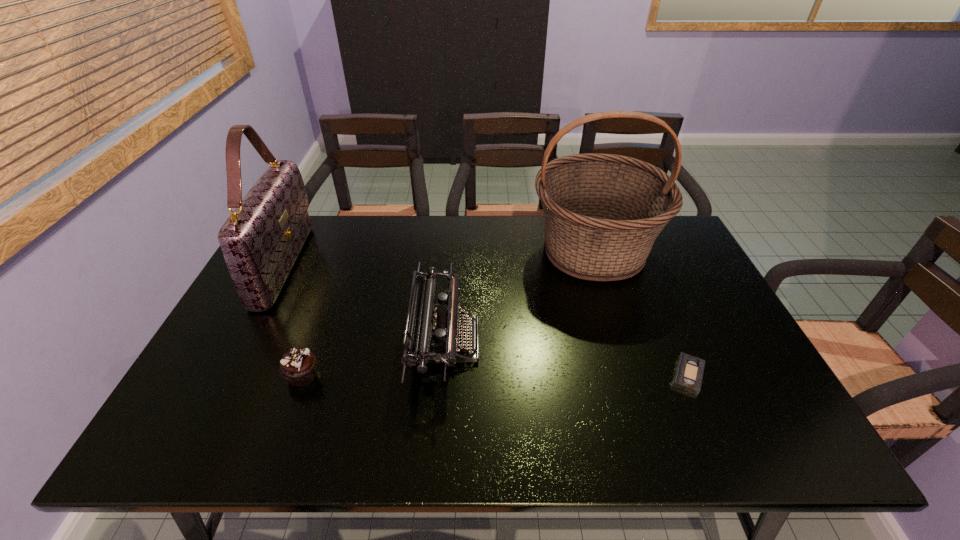
You are a GUI agent. You are given a task and a screenshot of the screen. Output one action in this format:
    pyautogui.click(x=<x>, y=<y>)
    Task: Click on the free space that satisfies the following two spatial constraints: 1. on the front of the handbag with the clasp; 2. on the right side of the fourth object from right to left
    
    Given the screenshot: What is the action you would take?
    pyautogui.click(x=227, y=375)

Find the location of a particular element. The height and width of the screenshot is (540, 960). vacant position in the image that satisfies the following two spatial constraints: 1. on the front of the cupcake with the clasp; 2. on the left side of the leftmost object is located at coordinates (227, 375).

The width and height of the screenshot is (960, 540). Identify the location of vacant space that satisfies the following two spatial constraints: 1. on the typing side of the third shortest object; 2. on the back side of the videotape. (443, 375).

I want to click on vacant area that satisfies the following two spatial constraints: 1. on the front of the leftmost object with the clasp; 2. on the right side of the videotape, so 228,375.

You are a GUI agent. You are given a task and a screenshot of the screen. Output one action in this format:
    pyautogui.click(x=<x>, y=<y>)
    Task: Click on the vacant position in the image that satisfies the following two spatial constraints: 1. on the front side of the basket; 2. on the front of the leftmost object with the clasp
    
    Given the screenshot: What is the action you would take?
    pyautogui.click(x=598, y=265)